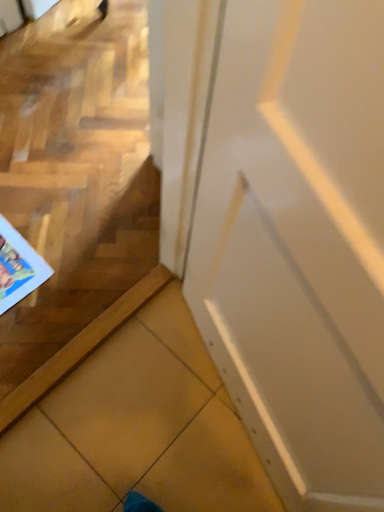
Question: From a real-world perspective, is white glossy door at center above or below matte paper comic book at lower left?

Choices:
 (A) above
 (B) below

Answer: (A)

Question: Considering the positions of white glossy door at center and matte paper comic book at lower left in the image, is white glossy door at center bigger or smaller than matte paper comic book at lower left?

Choices:
 (A) big
 (B) small

Answer: (A)

Question: In the image, is white glossy door at center positioned in front of or behind matte paper comic book at lower left?

Choices:
 (A) behind
 (B) front

Answer: (B)

Question: Considering the positions of matte paper comic book at lower left and white glossy door at center in the image, is matte paper comic book at lower left wider or thinner than white glossy door at center?

Choices:
 (A) wide
 (B) thin

Answer: (A)

Question: Do you think matte paper comic book at lower left is within white glossy door at center, or outside of it?

Choices:
 (A) inside
 (B) outside

Answer: (B)

Question: From the image's perspective, is matte paper comic book at lower left above or below white glossy door at center?

Choices:
 (A) below
 (B) above

Answer: (B)

Question: Considering their positions, is matte paper comic book at lower left located in front of or behind white glossy door at center?

Choices:
 (A) front
 (B) behind

Answer: (B)